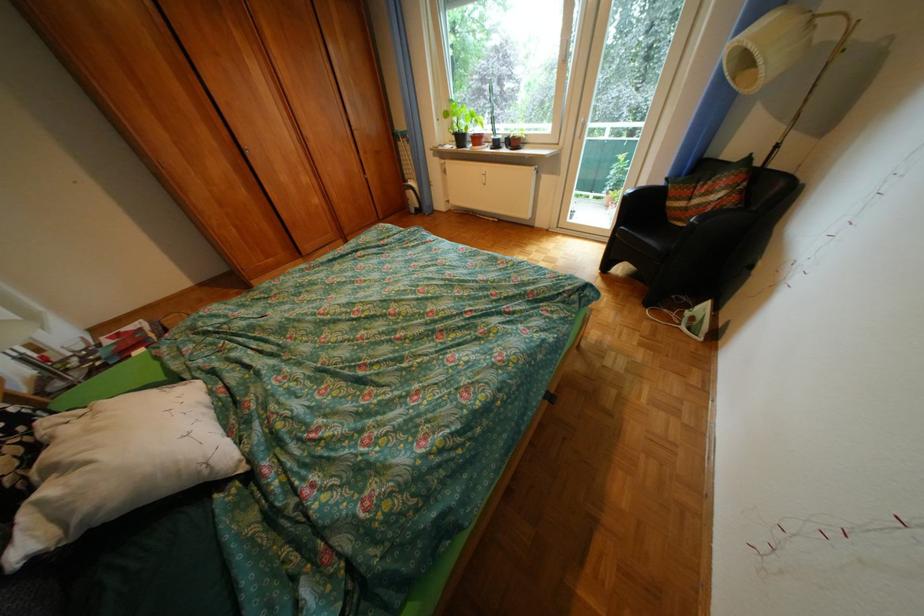
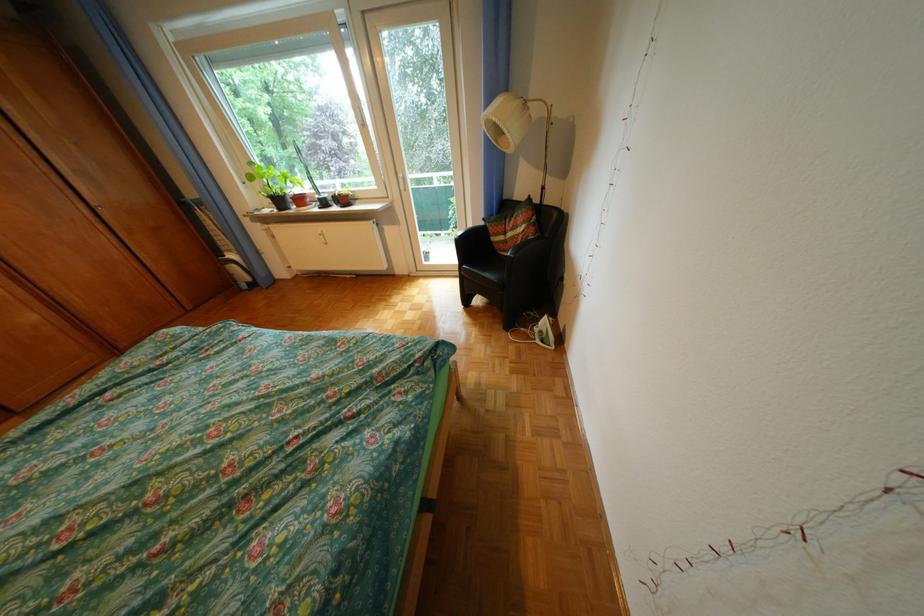
Locate, in the second image, the point that corresponds to point (711, 203) in the first image.

(524, 236)